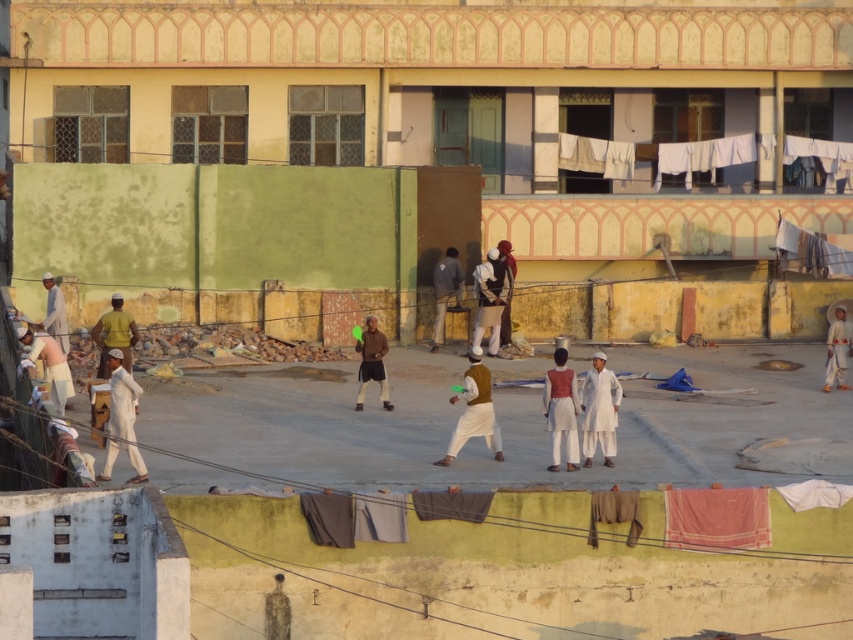
Question: Is brown matte vest at center wider than white cotton hat at center?

Choices:
 (A) yes
 (B) no

Answer: (A)

Question: Is light brown cotton kurta at center below dark gray fabric at center?

Choices:
 (A) no
 (B) yes

Answer: (B)

Question: Among these objects, which one is farthest from the camera?

Choices:
 (A) light beige fabric at lower left
 (B) yellow fabric at center

Answer: (B)

Question: Which point is closer to the camera?

Choices:
 (A) white cotton hat at center
 (B) brown leather jacket at center
 (C) light brown cotton shirt at left

Answer: (A)

Question: Estimate the real-world distances between objects in this image. Which object is closer to the dark gray fabric at center?

Choices:
 (A) yellow fabric at center
 (B) white cotton hat at center
 (C) light brown cotton shirt at left
 (D) white fabric at upper right

Answer: (D)

Question: Is the position of yellow fabric at center more distant than that of dark gray fabric at center?

Choices:
 (A) no
 (B) yes

Answer: (A)